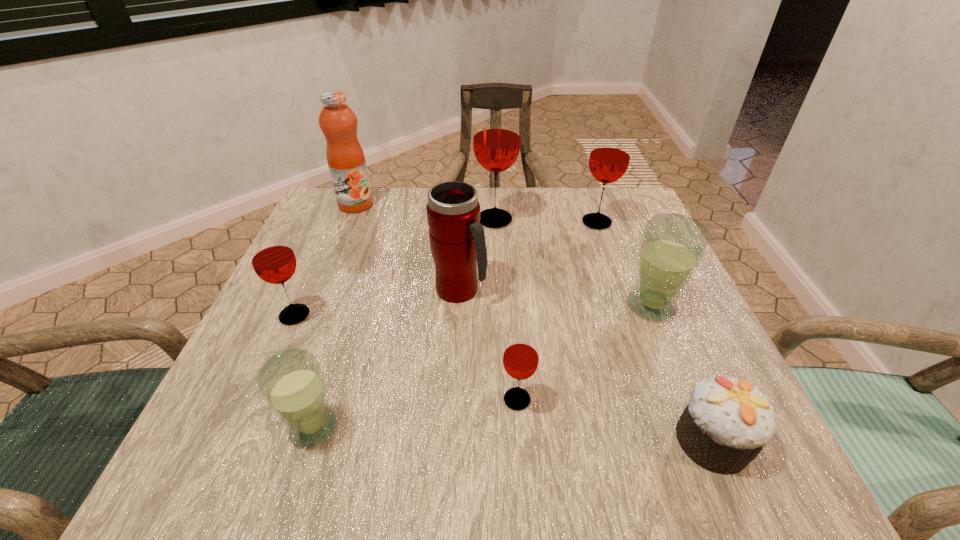
I want to click on red glass that is the second closest to the nearest red glass, so click(496, 142).

Find the location of a particular element. The image size is (960, 540). vacant space that satisfies the following two spatial constraints: 1. on the front label of the nearer blue glass; 2. on the left side of the fruit juice is located at coordinates (267, 428).

The height and width of the screenshot is (540, 960). Identify the location of free space that satisfies the following two spatial constraints: 1. on the front label of the second biggest red glass; 2. on the left side of the fruit juice. (348, 222).

Where is `free space that satisfies the following two spatial constraints: 1. on the front label of the orange fruit juice; 2. on the left side of the nearer blue glass`? Image resolution: width=960 pixels, height=540 pixels. free space that satisfies the following two spatial constraints: 1. on the front label of the orange fruit juice; 2. on the left side of the nearer blue glass is located at coordinates (267, 428).

Locate an element on the screen. Image resolution: width=960 pixels, height=540 pixels. vacant space that satisfies the following two spatial constraints: 1. on the front side of the second tallest glass; 2. on the right side of the farther blue glass is located at coordinates (626, 306).

Locate an element on the screen. The width and height of the screenshot is (960, 540). free spot that satisfies the following two spatial constraints: 1. on the front label of the fifth shortest glass; 2. on the right side of the orange fruit juice is located at coordinates (348, 222).

You are a GUI agent. You are given a task and a screenshot of the screen. Output one action in this format:
    pyautogui.click(x=<x>, y=<y>)
    Task: Click on the vacant space that satisfies the following two spatial constraints: 1. on the front side of the tallest glass; 2. on the right side of the second tallest glass
    This screenshot has width=960, height=540.
    Given the screenshot: What is the action you would take?
    pyautogui.click(x=494, y=222)